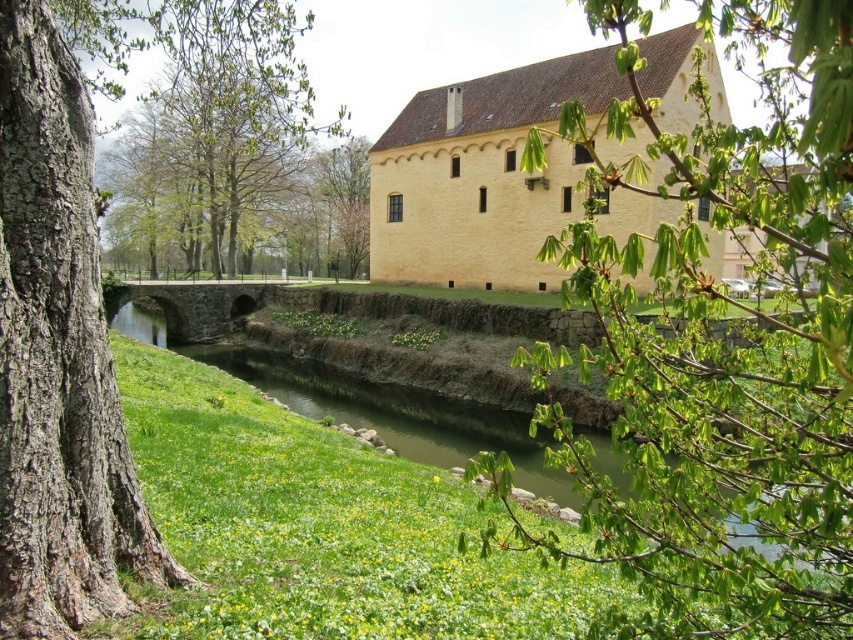
Question: Based on their relative distances, which object is farther from the green leafy branch at upper right?

Choices:
 (A) green leafy tree at upper center
 (B) green leafy tree at center

Answer: (A)

Question: Is green leafy branch at upper right above green leafy tree at center?

Choices:
 (A) yes
 (B) no

Answer: (B)

Question: Is green leafy branch at upper right above green leafy tree at center?

Choices:
 (A) no
 (B) yes

Answer: (A)

Question: Which point is farther to the camera?

Choices:
 (A) green leafy tree at upper center
 (B) smooth bark tree at left
 (C) green leafy branch at upper right
 (D) green leafy tree at center

Answer: (A)

Question: Is green leafy branch at upper right thinner than smooth bark tree at left?

Choices:
 (A) no
 (B) yes

Answer: (A)

Question: Which is nearer to the green leafy tree at upper center?

Choices:
 (A) smooth bark tree at left
 (B) green leafy tree at center
 (C) green leafy branch at upper right

Answer: (B)